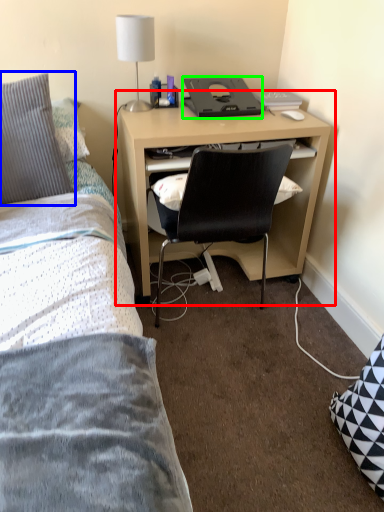
Question: Considering the real-world distances, which object is closest to computer desk (highlighted by a red box)? pillow (highlighted by a blue box) or desktop (highlighted by a green box).

Choices:
 (A) pillow
 (B) desktop

Answer: (B)